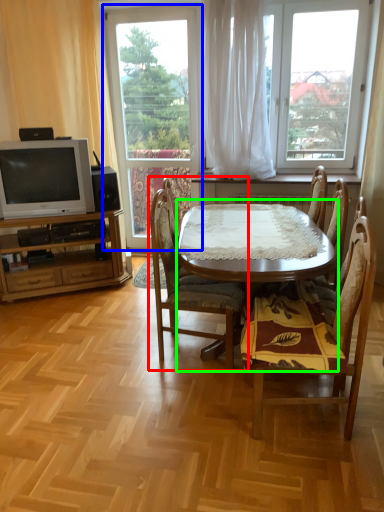
Question: Which is nearer to the chair (highlighted by a red box)? window (highlighted by a blue box) or round table (highlighted by a green box).

Choices:
 (A) window
 (B) round table

Answer: (B)